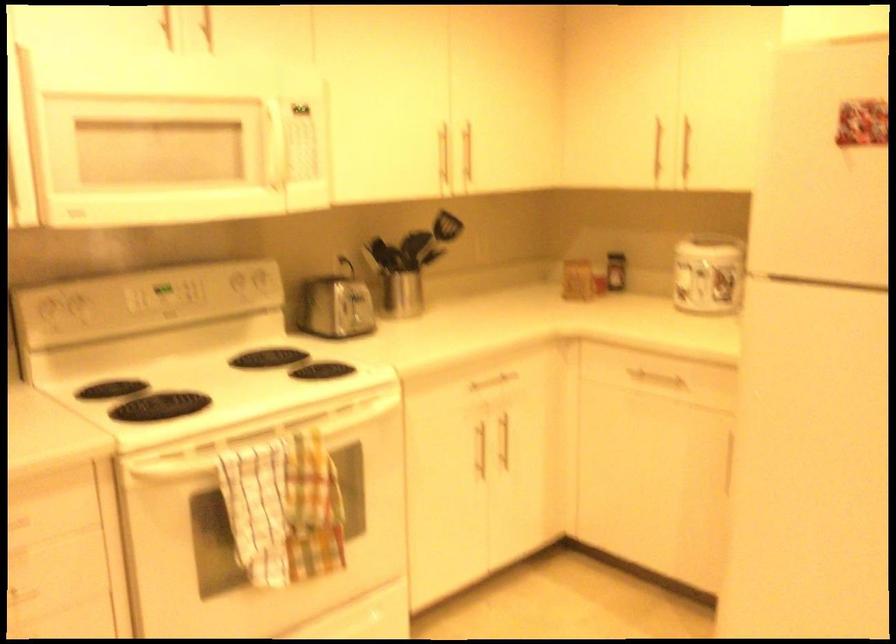
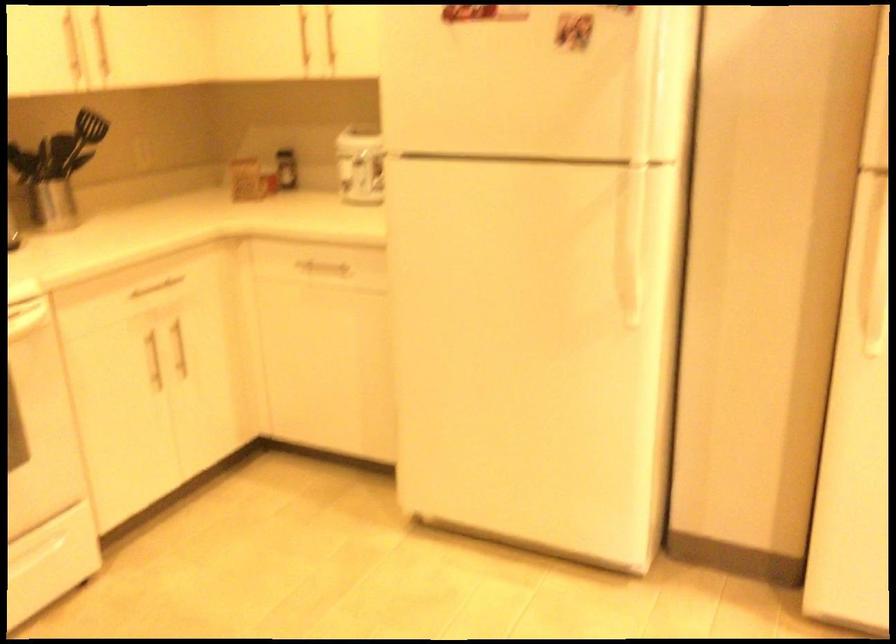
Question: Based on the continuous images, in which direction is the camera rotating? Reply with the corresponding letter.

Choices:
 (A) Left
 (B) Right
 (C) Up
 (D) Down

Answer: (B)